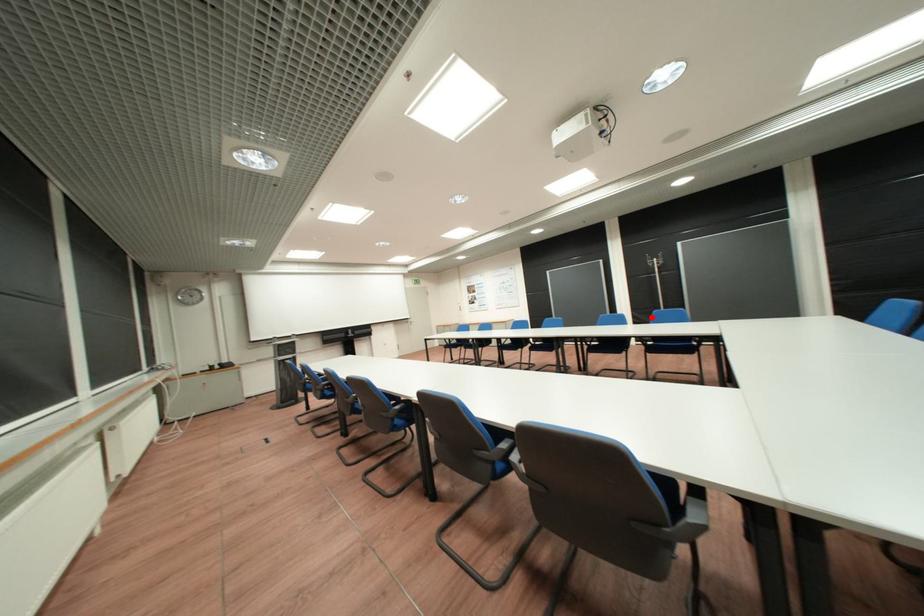
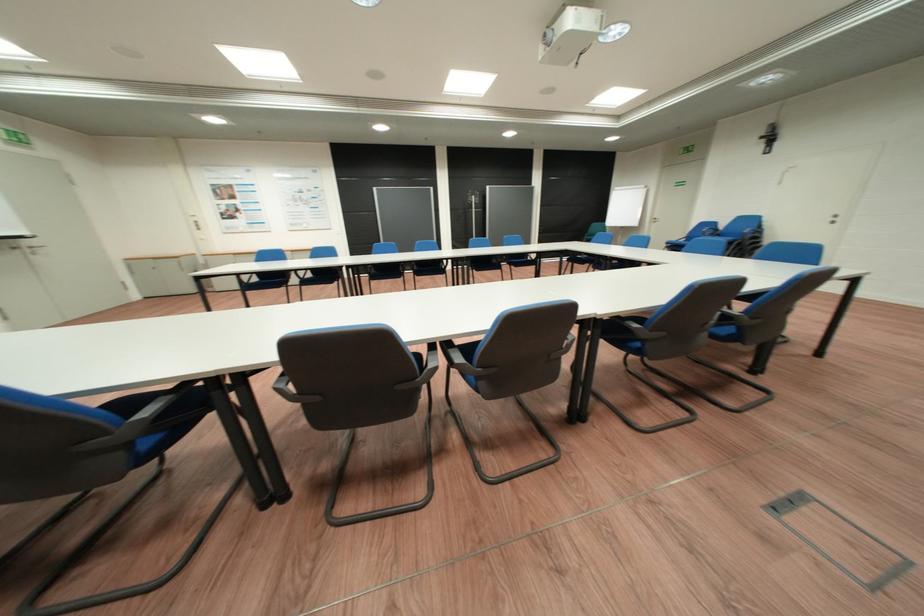
Where in the second image is the point corresponding to the highlighted location from the first image?

(468, 246)